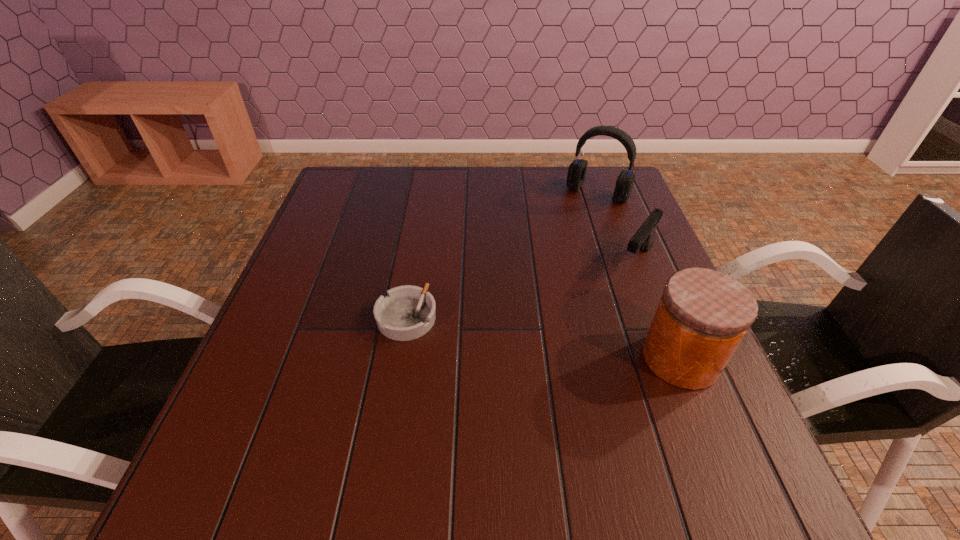
You are a GUI agent. You are given a task and a screenshot of the screen. Output one action in this format:
    pyautogui.click(x=<x>, y=<y>)
    Task: Click on the free location at the near edge of the desktop
    
    Given the screenshot: What is the action you would take?
    click(501, 402)

What are the coordinates of `blank space at the left edge` in the screenshot? It's located at (323, 287).

Locate an element on the screen. vacant area at the right edge of the desktop is located at coordinates (648, 290).

This screenshot has width=960, height=540. What are the coordinates of `free spot at the far left corner of the desktop` in the screenshot? It's located at (347, 198).

The width and height of the screenshot is (960, 540). In the image, there is a desktop. Find the location of `vacant space at the far right corner`. vacant space at the far right corner is located at coordinates (605, 206).

Identify the location of free spot between the pistol and the leftmost object. (521, 289).

This screenshot has width=960, height=540. Find the location of `vacant area that lies between the ashtray and the jar`. vacant area that lies between the ashtray and the jar is located at coordinates (543, 338).

Image resolution: width=960 pixels, height=540 pixels. Find the location of `vacant area that lies between the third nearest object and the headset`. vacant area that lies between the third nearest object and the headset is located at coordinates (617, 226).

Locate an element on the screen. The image size is (960, 540). unoccupied area between the leftmost object and the third tallest object is located at coordinates (521, 289).

The image size is (960, 540). I want to click on free point between the farthest object and the shortest object, so click(x=502, y=255).